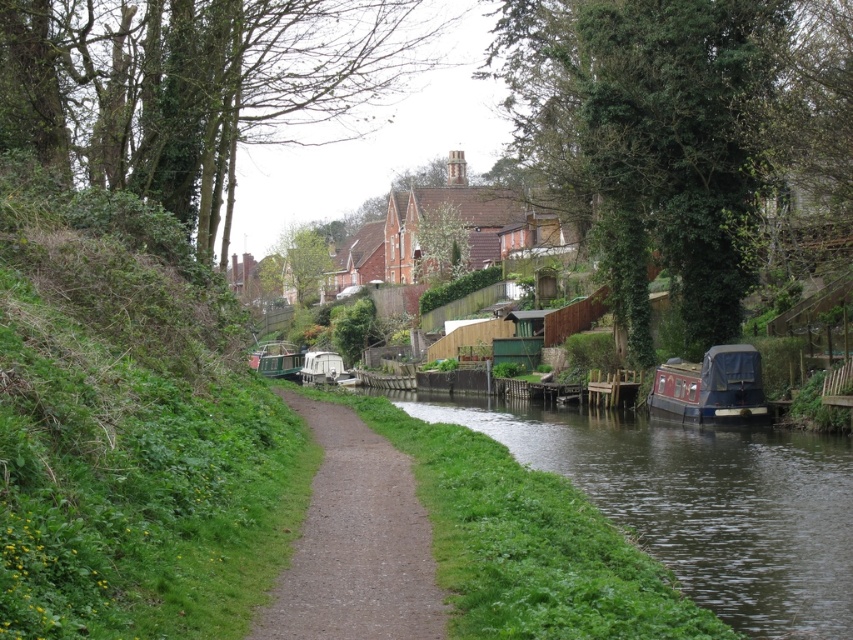
You are a photographer standing on the path and want to capture both the green leafy tree at center and the white plastic boat at center in your shot. Which object will appear closer to the camera in the photo?

The green leafy tree at center will appear closer to the camera because it is in front of the white plastic boat at center.

In the scene shown: You are standing on the canal path and want to take a photo of both point (x=354, y=636) and point (x=440, y=257). Which point should you focus on first to ensure both are in clear view?

You should focus on point (x=354, y=636) first because it is closer to the camera than point (x=440, y=257), ensuring both points are in focus.

You are standing at the edge of the canal and want to walk towards the two points marked in the scene. Which point, point (460, 237) or point (326, 358), will you reach first?

You will reach point (460, 237) first because it is closer to you than point (326, 358), which is further away.